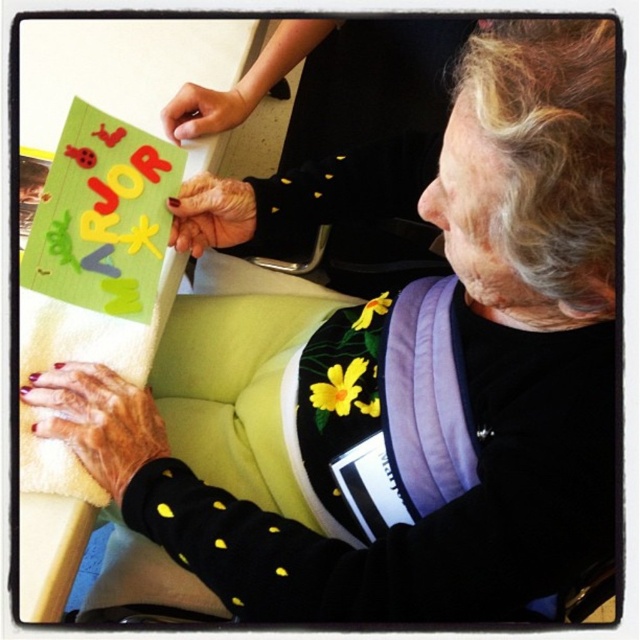
Question: Which of the following is the farthest from the observer?

Choices:
 (A) (180, 108)
 (B) (186, 243)
 (C) (168, 164)
 (D) (156, 449)

Answer: (A)

Question: Which point appears closest to the camera in this image?

Choices:
 (A) (182, 88)
 (B) (90, 385)
 (C) (40, 240)
 (D) (209, 227)

Answer: (B)

Question: Which point is closer to the camera?

Choices:
 (A) (205, 196)
 (B) (179, 138)

Answer: (A)

Question: Does nail polish painted fingernails at lower left have a larger size compared to matte skin hand at upper center?

Choices:
 (A) no
 (B) yes

Answer: (B)

Question: Does green felt sign at upper left appear on the right side of matte skin hand at upper center?

Choices:
 (A) yes
 (B) no

Answer: (B)

Question: Can you confirm if green felt sign at upper left is smaller than smooth skin hand at center?

Choices:
 (A) no
 (B) yes

Answer: (A)